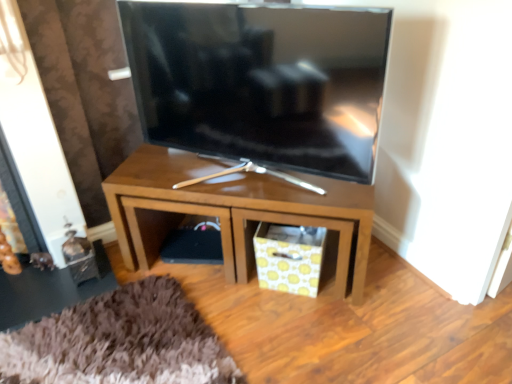
Locate an element on the screen. wooden tv stand at center is located at coordinates (233, 210).

At what (x,y) coordinates should I click in order to perform the action: click on yellow patterned paper at lower center. Please return your answer as a coordinate pair (x, y). The height and width of the screenshot is (384, 512). Looking at the image, I should click on (289, 257).

Are satin black tv at center and shiny metallic side table at lower left beside each other?

satin black tv at center is not next to shiny metallic side table at lower left, and they're not touching.

Which point is more distant from viewer, (205, 4) or (110, 283)?

Positioned behind is point (110, 283).

The image size is (512, 384). In order to click on side table behind the satin black tv at center in this screenshot , I will do `click(51, 289)`.

Is satin black tv at center at the right side of shiny metallic side table at lower left?

Yes.

How different are the orientations of satin black tv at center and wooden tv stand at center in degrees?

They differ by 16.5 degrees in their facing directions.

Is satin black tv at center in front of or behind wooden tv stand at center in the image?

satin black tv at center is positioned closer to the viewer than wooden tv stand at center.

Considering the relative sizes of satin black tv at center and wooden tv stand at center in the image provided, is satin black tv at center wider than wooden tv stand at center?

Incorrect, the width of satin black tv at center does not surpass that of wooden tv stand at center.

Is satin black tv at center to the left of wooden tv stand at center from the viewer's perspective?

Yes.

Is satin black tv at center taller or shorter than yellow patterned paper at lower center?

satin black tv at center is taller than yellow patterned paper at lower center.

From a real-world perspective, is satin black tv at center located beneath yellow patterned paper at lower center?

No, from a real-world perspective, satin black tv at center is not beneath yellow patterned paper at lower center.

Is satin black tv at center oriented towards yellow patterned paper at lower center?

No, satin black tv at center is not turned towards yellow patterned paper at lower center.

From a real-world perspective, which object rests below the other?

yellow patterned paper at lower center, from a real-world perspective.

Looking at this image, is wooden tv stand at center aimed at yellow patterned paper at lower center?

Yes, wooden tv stand at center is facing yellow patterned paper at lower center.

Is wooden tv stand at center not near yellow patterned paper at lower center?

wooden tv stand at center is near yellow patterned paper at lower center, not far away.

At what (x,y) coordinates should I click in order to perform the action: click on table above the yellow patterned paper at lower center (from the image's perspective). Please return your answer as a coordinate pair (x, y). The height and width of the screenshot is (384, 512). Looking at the image, I should click on (233, 210).

Does point (263, 273) come in front of point (309, 207)?

No, (263, 273) is behind (309, 207).

From a real-world perspective, relative to wooden tv stand at center, is yellow patterned paper at lower center vertically above or below?

Clearly, from a real-world perspective, yellow patterned paper at lower center is below wooden tv stand at center.

Which object is positioned more to the right, yellow patterned paper at lower center or wooden tv stand at center?

yellow patterned paper at lower center.

Does yellow patterned paper at lower center have a lesser width compared to shiny metallic side table at lower left?

Yes, yellow patterned paper at lower center is thinner than shiny metallic side table at lower left.

Which object is positioned more to the left, yellow patterned paper at lower center or shiny metallic side table at lower left?

From the viewer's perspective, shiny metallic side table at lower left appears more on the left side.

From a real-world perspective, is yellow patterned paper at lower center physically located above or below shiny metallic side table at lower left?

yellow patterned paper at lower center is above shiny metallic side table at lower left.

From the picture: Which object is closer to the camera, yellow patterned paper at lower center or shiny metallic side table at lower left?

yellow patterned paper at lower center is closer to the camera.

Does point (166, 207) come in front of point (53, 308)?

Yes, it is in front of point (53, 308).

Is wooden tv stand at center aimed at shiny metallic side table at lower left?

No, wooden tv stand at center is not facing towards shiny metallic side table at lower left.

Between wooden tv stand at center and shiny metallic side table at lower left, which one appears on the right side from the viewer's perspective?

Positioned to the right is wooden tv stand at center.

Find the location of a particular element. This screenshot has width=512, height=384. television above the shiny metallic side table at lower left (from a real-world perspective) is located at coordinates (261, 81).

Identify the location of table that appears below the satin black tv at center (from the image's perspective). This screenshot has height=384, width=512. (233, 210).

Estimate the real-world distances between objects in this image. Which object is further from wooden tv stand at center, shiny metallic side table at lower left or yellow patterned paper at lower center?

shiny metallic side table at lower left is positioned further to the anchor wooden tv stand at center.

Based on their spatial positions, is satin black tv at center or shiny metallic side table at lower left closer to yellow patterned paper at lower center?

satin black tv at center is positioned closer to the anchor yellow patterned paper at lower center.

In the scene shown: From the image, which object appears to be farther from satin black tv at center, yellow patterned paper at lower center or wooden tv stand at center?

yellow patterned paper at lower center is positioned further to the anchor satin black tv at center.

Which object lies nearer to the anchor point yellow patterned paper at lower center, satin black tv at center or wooden tv stand at center?

Based on the image, wooden tv stand at center appears to be nearer to yellow patterned paper at lower center.

Based on their spatial positions, is satin black tv at center or wooden tv stand at center closer to shiny metallic side table at lower left?

wooden tv stand at center lies closer to shiny metallic side table at lower left than the other object.

When comparing their distances from shiny metallic side table at lower left, does wooden tv stand at center or satin black tv at center seem closer?

wooden tv stand at center is positioned closer to the anchor shiny metallic side table at lower left.

Estimate the real-world distances between objects in this image. Which object is closer to wooden tv stand at center, yellow patterned paper at lower center or satin black tv at center?

The object closer to wooden tv stand at center is yellow patterned paper at lower center.

From the image, which object appears to be nearer to wooden tv stand at center, satin black tv at center or yellow patterned paper at lower center?

Among the two, yellow patterned paper at lower center is located nearer to wooden tv stand at center.

The image size is (512, 384). Find the location of `television between shiny metallic side table at lower left and yellow patterned paper at lower center in the horizontal direction`. television between shiny metallic side table at lower left and yellow patterned paper at lower center in the horizontal direction is located at coordinates (261, 81).

In order to click on television between shiny metallic side table at lower left and wooden tv stand at center in this screenshot , I will do `click(261, 81)`.

Where is `table between shiny metallic side table at lower left and yellow patterned paper at lower center in the horizontal direction`? This screenshot has width=512, height=384. table between shiny metallic side table at lower left and yellow patterned paper at lower center in the horizontal direction is located at coordinates (233, 210).

What are the coordinates of `table between satin black tv at center and yellow patterned paper at lower center from front to back` in the screenshot? It's located at (233, 210).